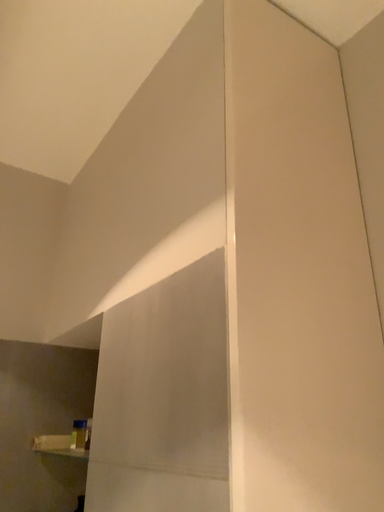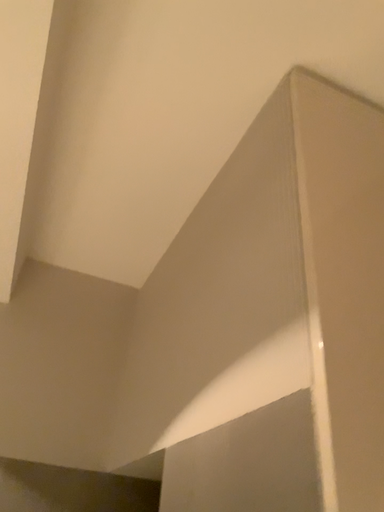
Question: Which way did the camera rotate in the video?

Choices:
 (A) rotated right
 (B) rotated left

Answer: (B)